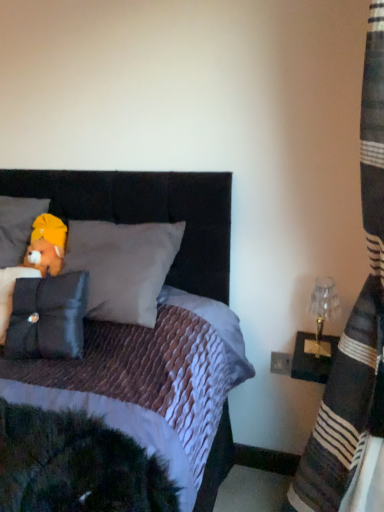
Question: Is point (372, 2) positioned closer to the camera than point (46, 272)?

Choices:
 (A) farther
 (B) closer

Answer: (B)

Question: From the image's perspective, is striped fabric curtain at right above or below brown plush bear at upper left?

Choices:
 (A) above
 (B) below

Answer: (B)

Question: Estimate the real-world distances between objects in this image. Which object is closer to the brown plush bear at upper left?

Choices:
 (A) soft gray pillow at upper left, placed as the 1th pillow when sorted from top to bottom
 (B) velvet black headboard at upper center
 (C) striped fabric curtain at right
 (D) black velvet pillow at left, which is the 2th pillow from back to front
 (E) clear glass lampshade at right

Answer: (A)

Question: Which object is positioned farthest from the soft gray pillow at upper left, which is the 2th pillow from front to back?

Choices:
 (A) velvet black headboard at upper center
 (B) black velvet pillow at left, which appears as the 2th pillow when viewed from the top
 (C) brown plush bear at upper left
 (D) striped fabric curtain at right
 (E) clear glass lampshade at right

Answer: (D)